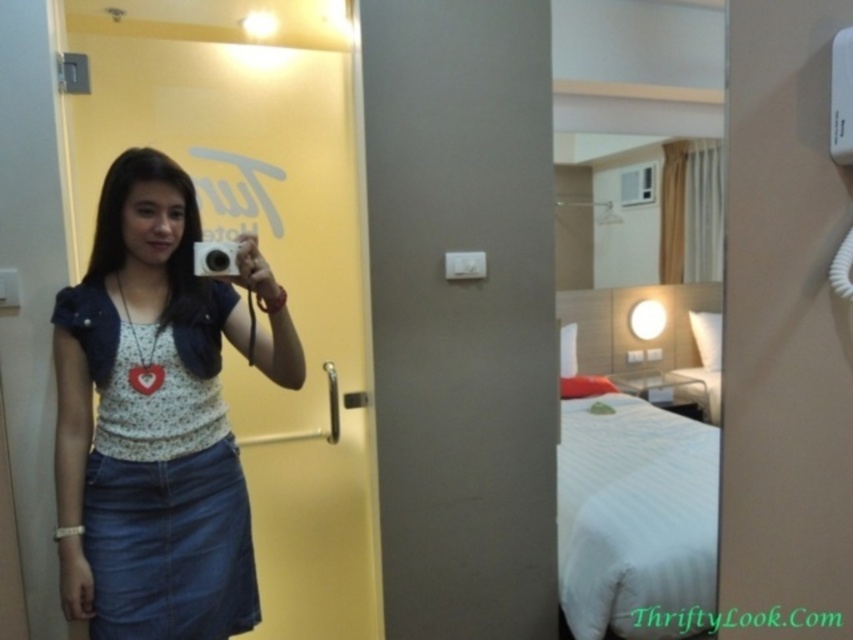
Question: From the image, what is the correct spatial relationship of denim skirt at center in relation to silver metallic camera at center?

Choices:
 (A) below
 (B) above

Answer: (A)

Question: Which of the following is the closest to the observer?

Choices:
 (A) (202, 266)
 (B) (83, 340)

Answer: (A)

Question: Is denim skirt at center to the right of silver metallic camera at center from the viewer's perspective?

Choices:
 (A) yes
 (B) no

Answer: (B)

Question: Which point is closer to the camera taking this photo?

Choices:
 (A) (142, 298)
 (B) (206, 253)

Answer: (B)

Question: Can you confirm if denim skirt at center is positioned to the left of silver metallic camera at center?

Choices:
 (A) yes
 (B) no

Answer: (A)